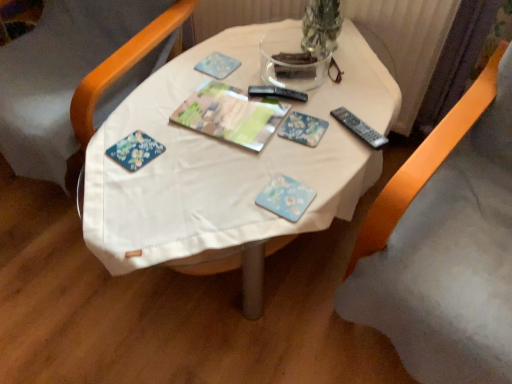
Identify the location of free space that is in between black plastic remote at right and floral-patterned paper at center, acting as the first paperback book starting from the top. The height and width of the screenshot is (384, 512). (337, 135).